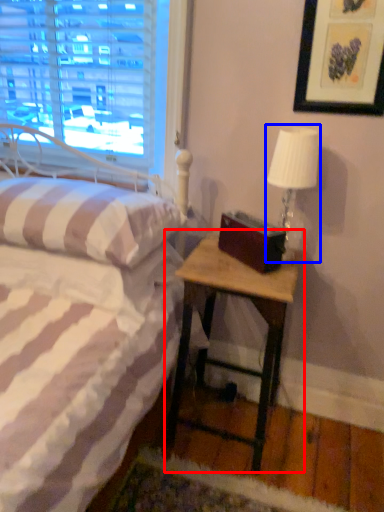
Question: Which object appears farthest to the camera in this image, nightstand (highlighted by a red box) or table lamp (highlighted by a blue box)?

Choices:
 (A) nightstand
 (B) table lamp

Answer: (B)